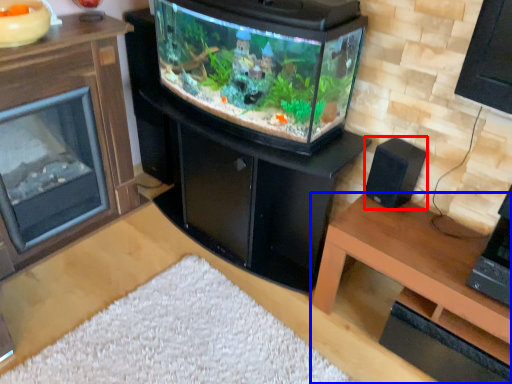
Question: Which object appears farthest to the camera in this image, speaker (highlighted by a red box) or table (highlighted by a blue box)?

Choices:
 (A) speaker
 (B) table

Answer: (A)